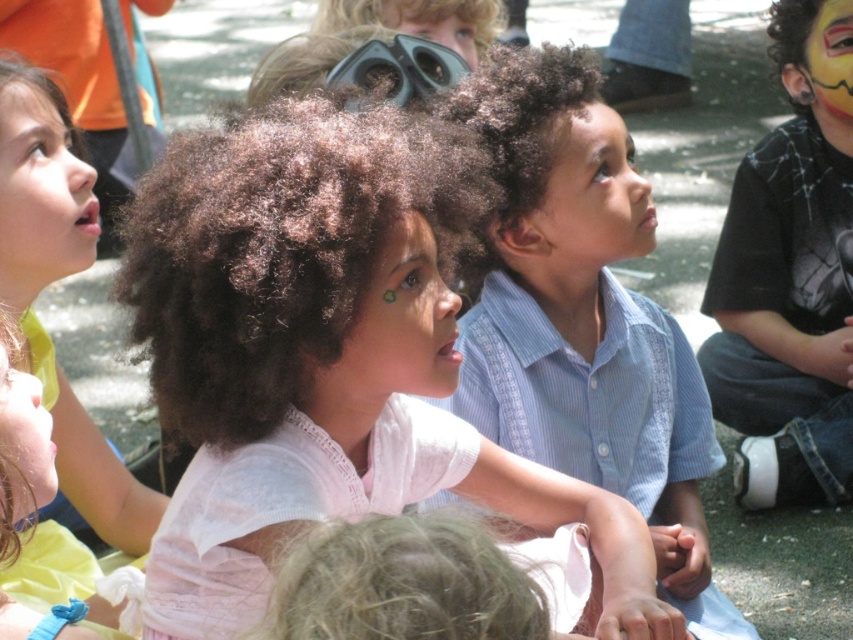
You are a photographer at this event and want to capture a photo that includes both the blue striped shirt at center and the painted face at upper right. Based on their positions, which one should you focus on first to ensure both are in the frame?

The blue striped shirt at center is located below the painted face at upper right, so you should focus on the painted face at upper right first to ensure both are in the frame.

Based on the scene description, which child has a face that could potentially be wider between the child with a smooth skin face at center and the child with a smooth green face at lower left?

The smooth skin face at center might be wider than the smooth green face at lower left according to the description.

You are a photographer trying to capture a clear shot of the matte white face at center and the smooth green face at lower left. Which child should you focus on first to ensure both are in focus?

You should focus on the matte white face at center first because the smooth green face at lower left is behind it, so focusing on the closer subject will help both be in focus.